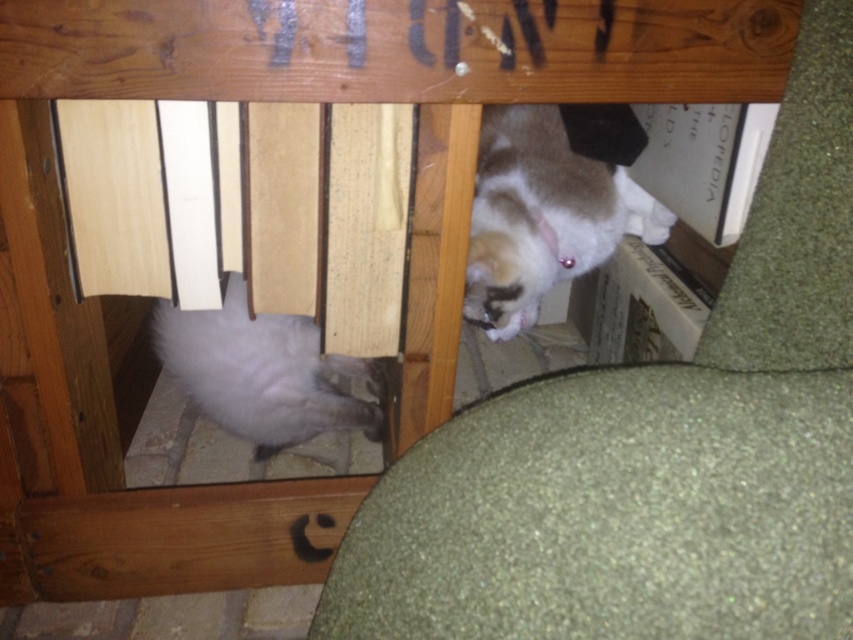
Does fuzzy white cat at upper right appear over silvery-gray fur at lower left?

Correct, fuzzy white cat at upper right is located above silvery-gray fur at lower left.

Does fuzzy white cat at upper right appear on the left side of silvery-gray fur at lower left?

Incorrect, fuzzy white cat at upper right is not on the left side of silvery-gray fur at lower left.

Between point (604, 202) and point (206, 323), which one is positioned in front?

Point (206, 323) is more forward.

Locate an element on the screen. fuzzy white cat at upper right is located at coordinates (543, 216).

In the scene shown: Is fuzzy fur cat at lower left taller than fuzzy white cat at upper right?

Yes.

Who is taller, fuzzy fur cat at lower left or fuzzy white cat at upper right?

fuzzy fur cat at lower left

The height and width of the screenshot is (640, 853). Identify the location of fuzzy fur cat at lower left. (653, 449).

Is fuzzy fur cat at lower left positioned behind silvery-gray fur at lower left?

No, fuzzy fur cat at lower left is closer to the viewer.

Image resolution: width=853 pixels, height=640 pixels. In order to click on fuzzy fur cat at lower left in this screenshot , I will do click(653, 449).

Is point (447, 512) closer to camera compared to point (235, 376)?

Yes, point (447, 512) is closer to viewer.

Find the location of a particular element. fuzzy fur cat at lower left is located at coordinates (653, 449).